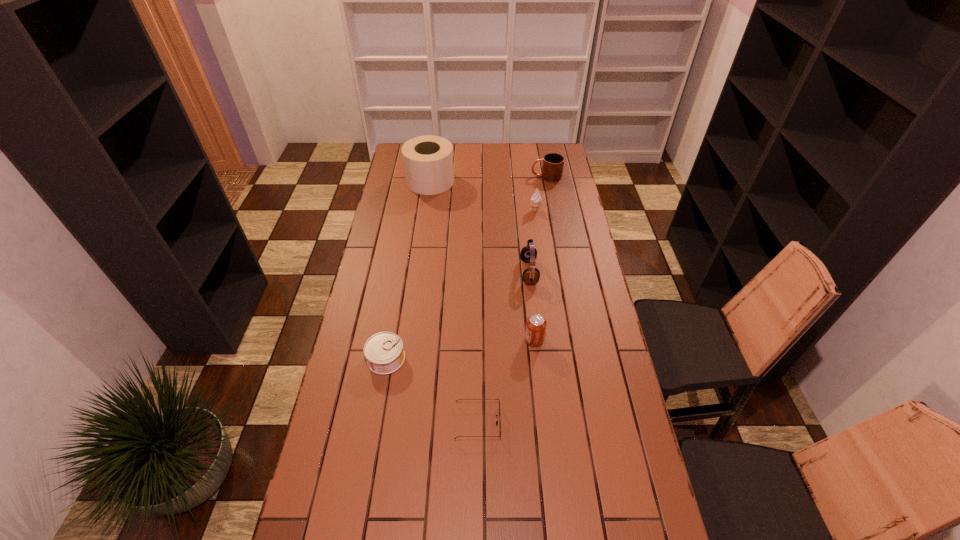
I want to click on vacant region located on the back of the shorter can, so click(x=397, y=293).

Where is `vacant space situated on the front-facing side of the nearest object`? The image size is (960, 540). vacant space situated on the front-facing side of the nearest object is located at coordinates (570, 422).

At what (x,y) coordinates should I click in order to perform the action: click on toilet tissue at the left edge. Please return your answer as a coordinate pair (x, y). Looking at the image, I should click on (428, 163).

Where is `can at the left edge`? This screenshot has width=960, height=540. can at the left edge is located at coordinates (384, 353).

You are a GUI agent. You are given a task and a screenshot of the screen. Output one action in this format:
    pyautogui.click(x=<x>, y=<y>)
    Task: Click on the object present at the right edge
    This screenshot has width=960, height=540.
    Given the screenshot: What is the action you would take?
    pyautogui.click(x=552, y=169)

You are a GUI agent. You are given a task and a screenshot of the screen. Output one action in this format:
    pyautogui.click(x=<x>, y=<y>)
    Task: Click on the vacant space at the left edge of the desktop
    
    Given the screenshot: What is the action you would take?
    pyautogui.click(x=388, y=379)

Locate an element on the screen. Image resolution: width=960 pixels, height=540 pixels. vacant space at the right edge of the desktop is located at coordinates (598, 465).

Locate an element on the screen. The width and height of the screenshot is (960, 540). vacant space at the far left corner is located at coordinates (395, 154).

Locate an element on the screen. This screenshot has width=960, height=540. free space at the far right corner is located at coordinates (537, 164).

Image resolution: width=960 pixels, height=540 pixels. In order to click on free space between the shorter can and the headset in this screenshot , I will do `click(458, 315)`.